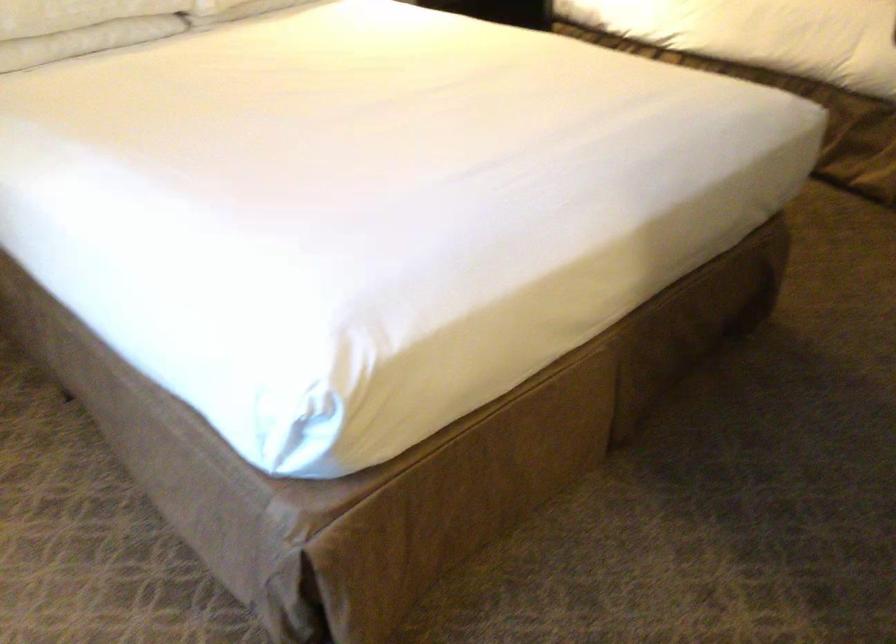
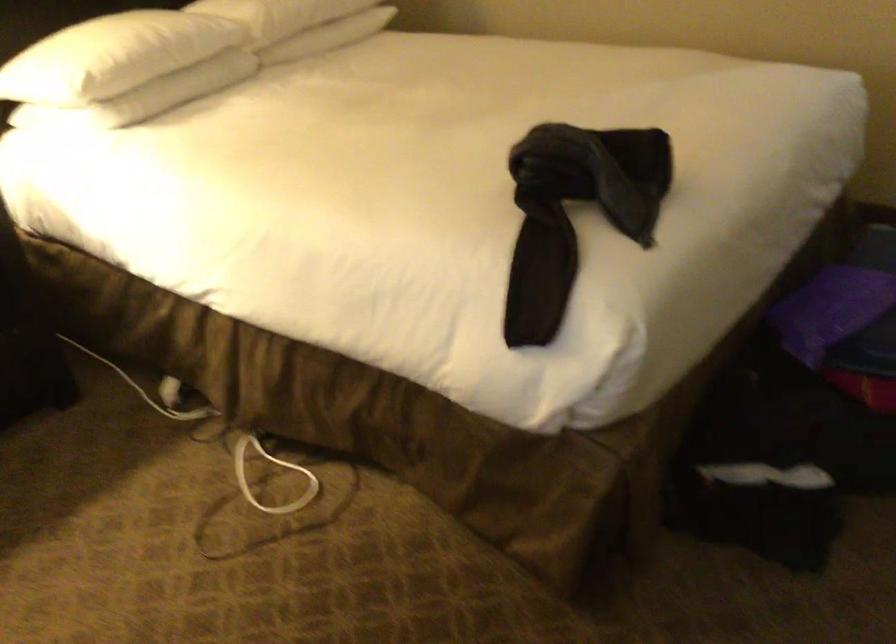
In a continuous first-person perspective shot, in which direction is the camera moving?

The cameraman moved toward right, forward.